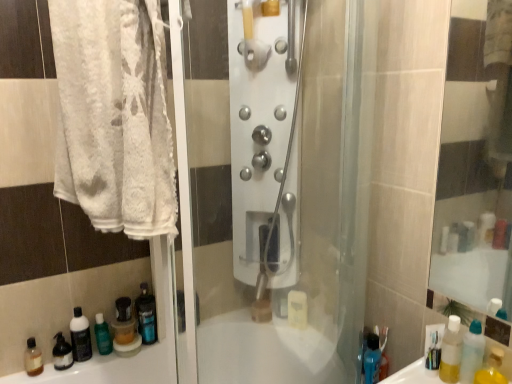
Question: From their relative heights in the image, would you say brown matte bottle at lower left, which is the third mouthwash in back-to-front order, is taller or shorter than green matte bottle at lower left?

Choices:
 (A) tall
 (B) short

Answer: (B)

Question: Would you say brown matte bottle at lower left, acting as the third mouthwash starting from the front, is to the left or to the right of green matte bottle at lower left in the picture?

Choices:
 (A) left
 (B) right

Answer: (A)

Question: Which is farther from the translucent plastic mouthwash at lower left, the 2th mouthwash positioned from the left?

Choices:
 (A) satin nickel shower controls at center
 (B) yellow translucent bottle at lower right, placed as the 5th mouthwash when sorted from left to right
 (C) translucent plastic mouthwash at lower left, the 5th mouthwash when ordered from front to back
 (D) white soft towel at left
 (E) brown matte bottle at lower left, which is the third mouthwash in back-to-front order

Answer: (B)

Question: Estimate the real-world distances between objects in this image. Which object is farther from the white soft towel at left?

Choices:
 (A) transparent plastic bottle at lower right, the 3th bottle when ordered from back to front
 (B) translucent plastic bottle at lower left, the first bottle when ordered from left to right
 (C) translucent plastic mouthwash at lower left, arranged as the 1th mouthwash when viewed from the back
 (D) yellow translucent bottle at lower right, the first mouthwash viewed from the right
 (E) satin nickel shower controls at center

Answer: (A)